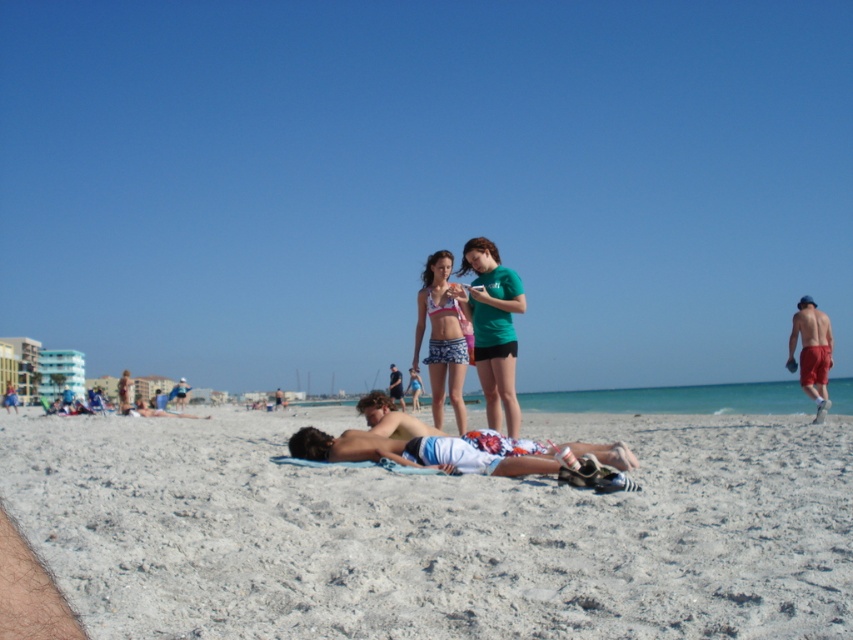
You are a photographer trying to capture a photo of the beach scene. You notice the blue denim shorts at lower left and the tan skin man at center. Which object is taller in the image?

The blue denim shorts at lower left is taller than the tan skin man at center according to the description.

Consider the image. You are a photographer standing on the beach and want to capture both the tan skin man at lower left and the smooth tan skin at center in the same frame. Based on their positions, which one would appear lower in the photo?

The tan skin man at lower left would appear lower in the photo since he is positioned below the smooth tan skin at center.

You are a photographer trying to capture the perfect shot of the beach scene. You want to ensure the blue denim shorts at lower left are centered in your frame. Given their current position at coordinates 0.617 on the x and 0.211 on the y, what adjustments should you make to the camera to center them?

To center the blue denim shorts at lower left, adjust the camera so the x coordinate moves to 0.5 and the y coordinate moves to 0.5. Since the current x is 0.617, move the camera left slightly to decrease the x value. The y coordinate 0.211 needs to be increased by moving the camera upward to raise it closer to 0.5.